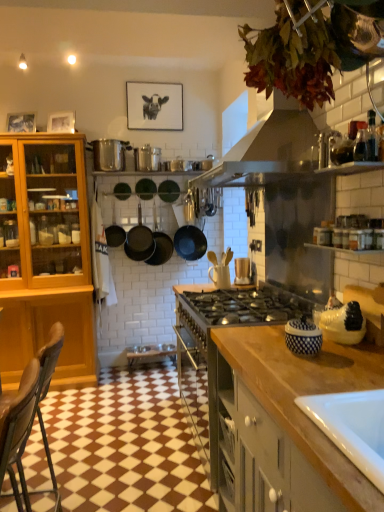
Where is `empty space that is ontop of black matte picture frame at upper center, the 1th picture frame from the back`? The image size is (384, 512). empty space that is ontop of black matte picture frame at upper center, the 1th picture frame from the back is located at coordinates (164, 78).